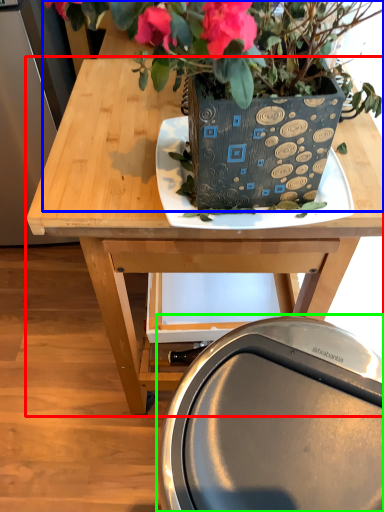
Question: Considering the real-world distances, which object is closest to table (highlighted by a red box)? houseplant (highlighted by a blue box) or swivel chair (highlighted by a green box).

Choices:
 (A) houseplant
 (B) swivel chair

Answer: (A)